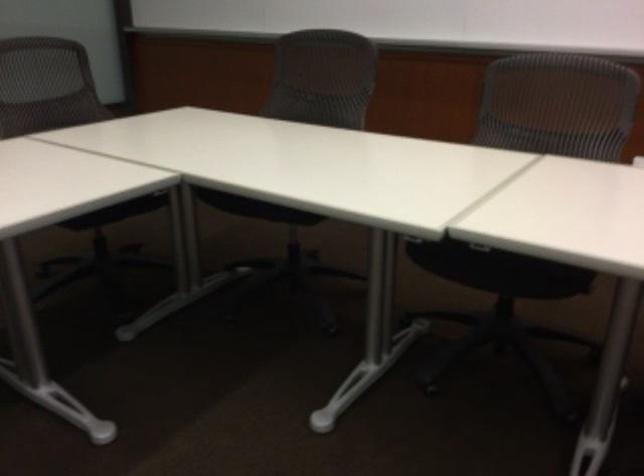
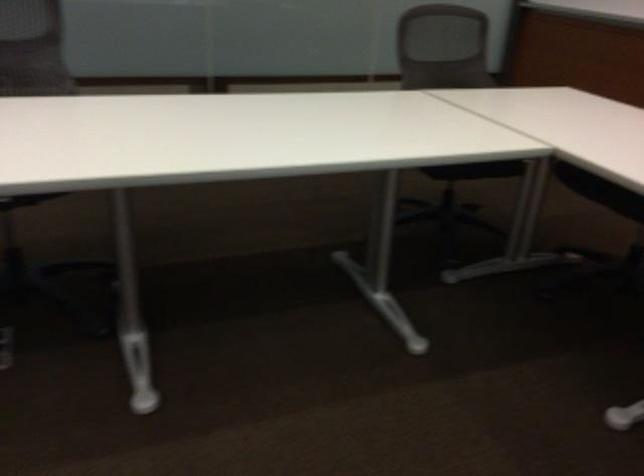
Question: The first image is from the beginning of the video and the second image is from the end. How did the camera likely rotate when shooting the video?

Choices:
 (A) Left
 (B) Right
 (C) Up
 (D) Down

Answer: (A)